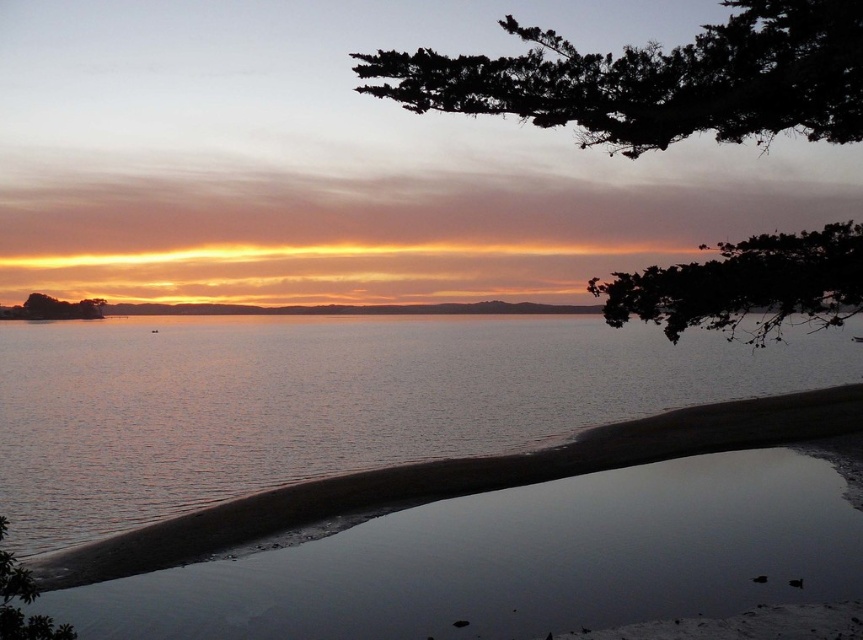
Who is shorter, dark green leafy tree at upper center or dark green textured rock at upper left?

Answer: Standing shorter between the two is dark green textured rock at upper left.

Who is more forward, (x=668, y=68) or (x=43, y=301)?

Point (x=668, y=68)

Locate an element on the screen. dark green leafy tree at upper center is located at coordinates point(657,81).

How distant is dark green leafy tree at upper center from dark green leafy branch at upper right?

dark green leafy tree at upper center and dark green leafy branch at upper right are 37.07 meters apart.

Based on the photo, between dark green leafy tree at upper center and dark green leafy branch at upper right, which one appears on the right side from the viewer's perspective?

From the viewer's perspective, dark green leafy tree at upper center appears more on the right side.

Does point (411, 86) lie in front of point (646, 294)?

That is True.

I want to click on dark green leafy tree at upper center, so click(x=657, y=81).

Between point (622, 147) and point (60, 632), which one is positioned in front?

Point (60, 632) is more forward.

Is dark green leafy tree at upper center behind green leafy tree at lower left?

Yes, it is.

Between point (589, 122) and point (16, 572), which one is positioned behind?

The point (589, 122) is behind.

Find the location of a particular element. Image resolution: width=863 pixels, height=640 pixels. dark green leafy tree at upper center is located at coordinates (657, 81).